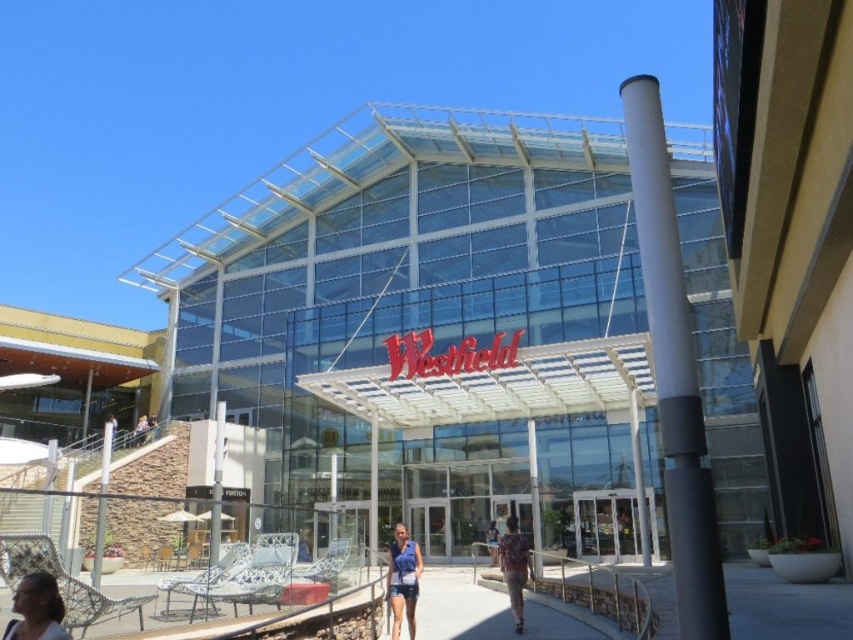
You are a fashion designer observing the two people at the shopping center. You need to determine which clothing item has a greater width between the matte blue shorts at center and the floral fabric shirt at lower center. Which one is wider?

The matte blue shorts at center has a greater width than the floral fabric shirt at lower center.

You are a fashion designer observing the modern shopping center exterior. You notice the blue denim shorts at center and the floral fabric shirt at lower center. Which clothing item has a narrower width?

The blue denim shorts at center has a lesser width compared to the floral fabric shirt at lower center, so the blue denim shorts at center is narrower in width.

You are standing on the walkway in front of the Westfield shopping center. You see a person with matte black hair at lower left and another wearing a floral fabric shirt at lower center. Which person is closer to you?

The matte black hair at lower left is closer to you because it is in front of the floral fabric shirt at lower center.